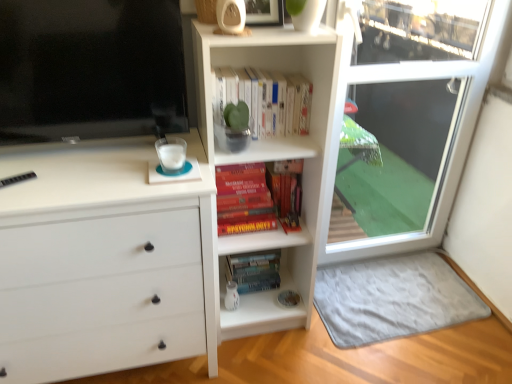
Find the location of `free space in front of gray soft rug at lower right`. free space in front of gray soft rug at lower right is located at coordinates (416, 359).